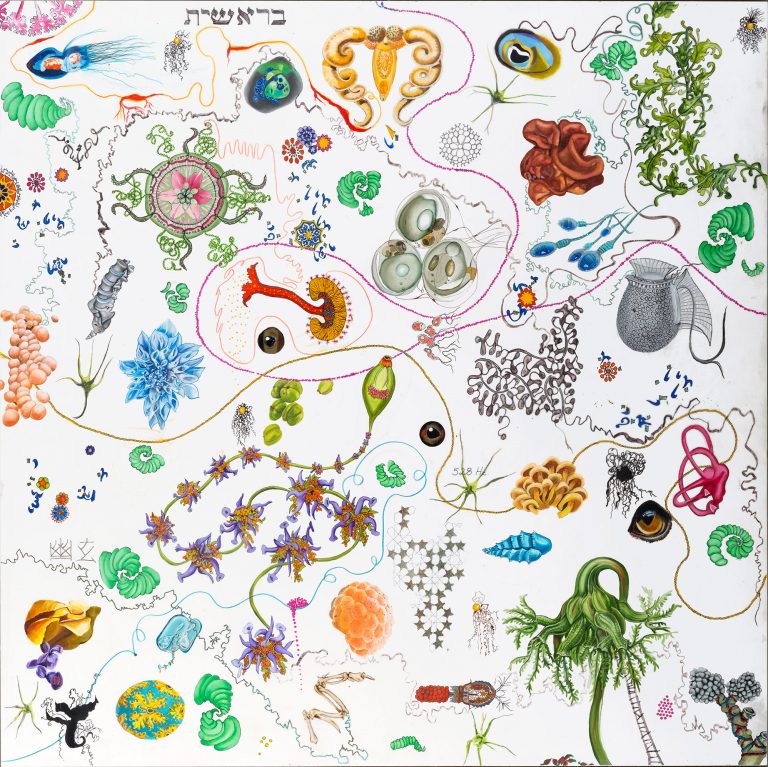
Image resolution: width=768 pixels, height=767 pixels. I want to click on large green plant, so click(570, 617).